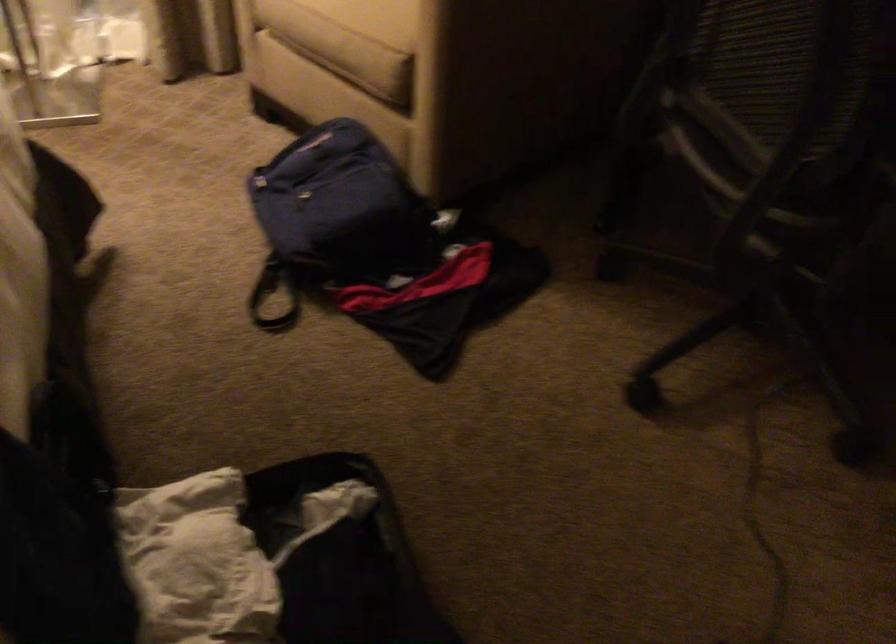
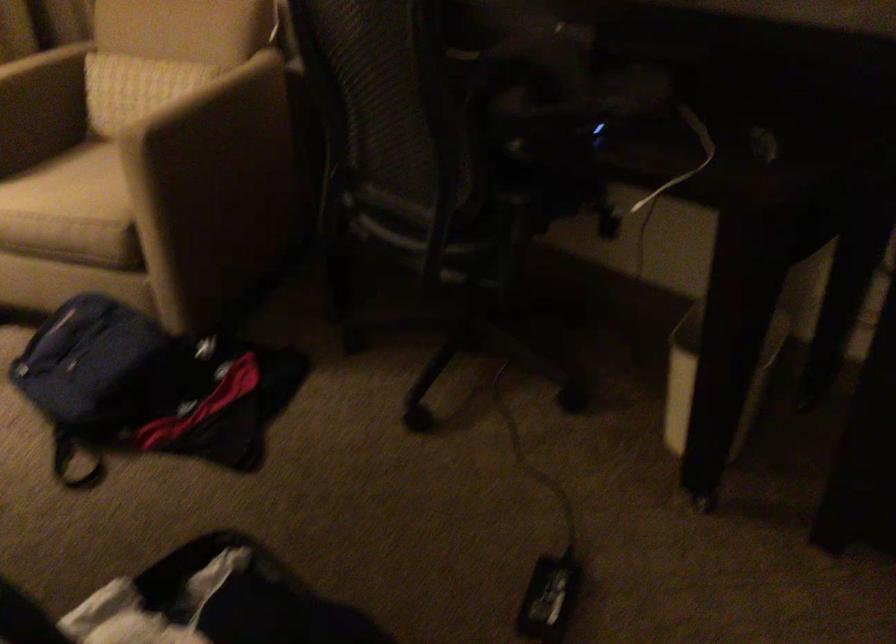
Question: The images are taken continuously from a first-person perspective. In which direction is your viewpoint rotating?

Choices:
 (A) Left
 (B) Right
 (C) Up
 (D) Down

Answer: (B)